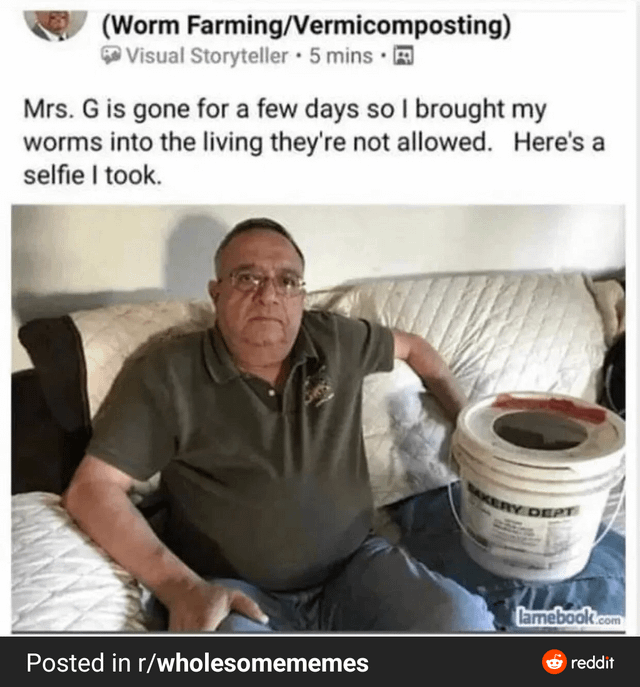
Identify the location of blue couch pillow with ruffle. (603, 573).